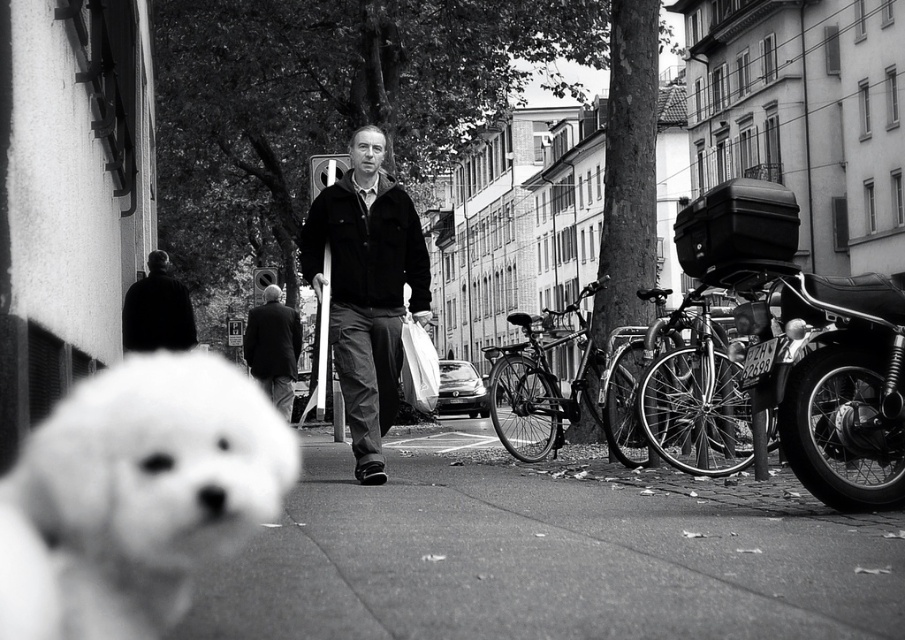
You are standing in the street scene shown in the image. You want to walk from the point closer to you to the point further away. Which path would you take between the two points, point (x=418, y=266) and point (x=284, y=392)?

You should walk from point (x=418, y=266) to point (x=284, y=392) because point (x=418, y=266) is closer to the viewer and the other point is further away.

You are a photographer standing in the scene and want to take a clear photo of the dark gray suit at center without the black matte jacket at center blocking it. What should you do?

Move your position so that the dark gray suit at center is no longer behind the black matte jacket at center. Since the black matte jacket at center is closer to the viewer than the dark gray suit at center, moving sideways or adjusting your angle could allow you to capture the dark gray suit at center without obstruction.